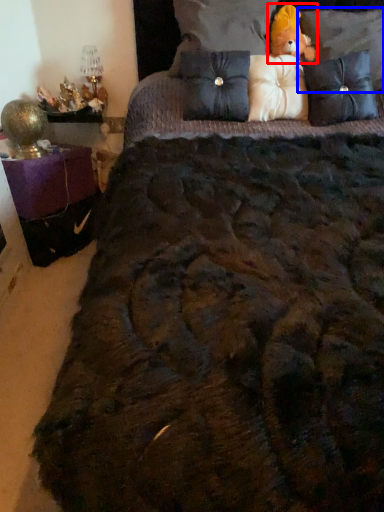
Question: Which object is closer to the camera taking this photo, figurine (highlighted by a red box) or pillow (highlighted by a blue box)?

Choices:
 (A) figurine
 (B) pillow

Answer: (B)